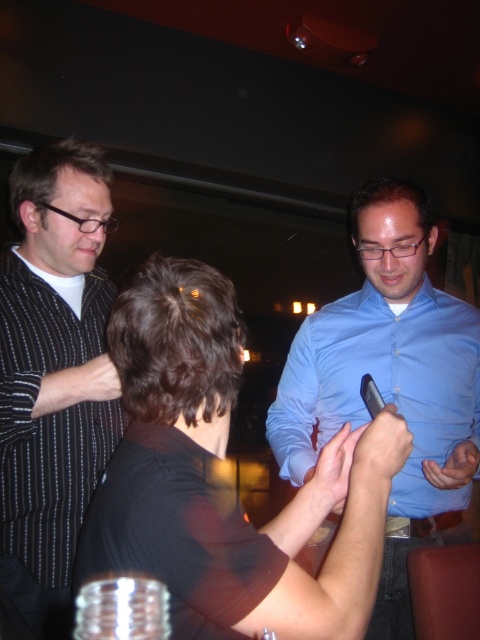
Question: Is black matte shirt at center bigger than blue shirt at center?

Choices:
 (A) yes
 (B) no

Answer: (B)

Question: Can you confirm if black matte shirt at center is smaller than blue shirt at center?

Choices:
 (A) no
 (B) yes

Answer: (B)

Question: Which object is the closest to the black striped shirt at left?

Choices:
 (A) blue shirt at center
 (B) black matte shirt at center

Answer: (A)

Question: Which of these objects is positioned closest to the black matte shirt at center?

Choices:
 (A) black striped shirt at left
 (B) blue shirt at center

Answer: (B)

Question: Does black matte shirt at center appear on the left side of black striped shirt at left?

Choices:
 (A) yes
 (B) no

Answer: (B)

Question: Considering the real-world distances, which object is farthest from the blue shirt at center?

Choices:
 (A) black striped shirt at left
 (B) black matte shirt at center

Answer: (A)